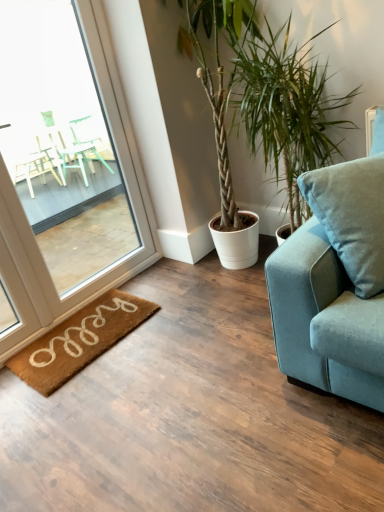
Question: Is the depth of velvet blue couch at right less than that of brown coir mat at lower left?

Choices:
 (A) no
 (B) yes

Answer: (B)

Question: From a real-world perspective, is velvet blue couch at right positioned over brown coir mat at lower left based on gravity?

Choices:
 (A) no
 (B) yes

Answer: (B)

Question: Does velvet blue couch at right have a smaller size compared to brown coir mat at lower left?

Choices:
 (A) yes
 (B) no

Answer: (B)

Question: From the image's perspective, does velvet blue couch at right appear higher than brown coir mat at lower left?

Choices:
 (A) yes
 (B) no

Answer: (A)

Question: From the image's perspective, is velvet blue couch at right below brown coir mat at lower left?

Choices:
 (A) yes
 (B) no

Answer: (B)

Question: Considering the relative positions of clear glass window at left and brown coir mat at lower left in the image provided, is clear glass window at left to the left or to the right of brown coir mat at lower left?

Choices:
 (A) left
 (B) right

Answer: (A)

Question: From the image's perspective, is clear glass window at left positioned above or below brown coir mat at lower left?

Choices:
 (A) above
 (B) below

Answer: (A)

Question: Looking at their shapes, would you say clear glass window at left is wider or thinner than brown coir mat at lower left?

Choices:
 (A) wide
 (B) thin

Answer: (B)

Question: From a real-world perspective, relative to brown coir mat at lower left, is clear glass window at left vertically above or below?

Choices:
 (A) above
 (B) below

Answer: (A)

Question: Is brown coir mat at lower left in front of or behind green leafy plant at center in the image?

Choices:
 (A) front
 (B) behind

Answer: (B)

Question: In terms of width, does brown coir mat at lower left look wider or thinner when compared to green leafy plant at center?

Choices:
 (A) wide
 (B) thin

Answer: (B)

Question: Is brown coir mat at lower left spatially inside green leafy plant at center, or outside of it?

Choices:
 (A) outside
 (B) inside

Answer: (A)

Question: From a real-world perspective, relative to green leafy plant at center, is brown coir mat at lower left vertically above or below?

Choices:
 (A) above
 (B) below

Answer: (B)

Question: In the image, is clear glass window at left on the left side or the right side of green leafy plant at center?

Choices:
 (A) left
 (B) right

Answer: (A)

Question: Is clear glass window at left in front of or behind green leafy plant at center in the image?

Choices:
 (A) front
 (B) behind

Answer: (A)